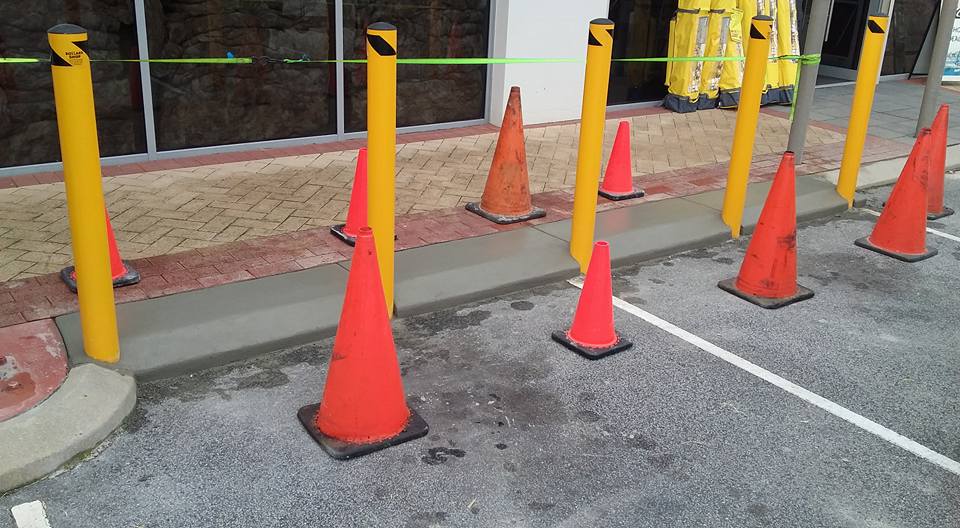
Identify the location of glass windows. (102, 105), (202, 109), (424, 98), (637, 29), (913, 24), (833, 53).